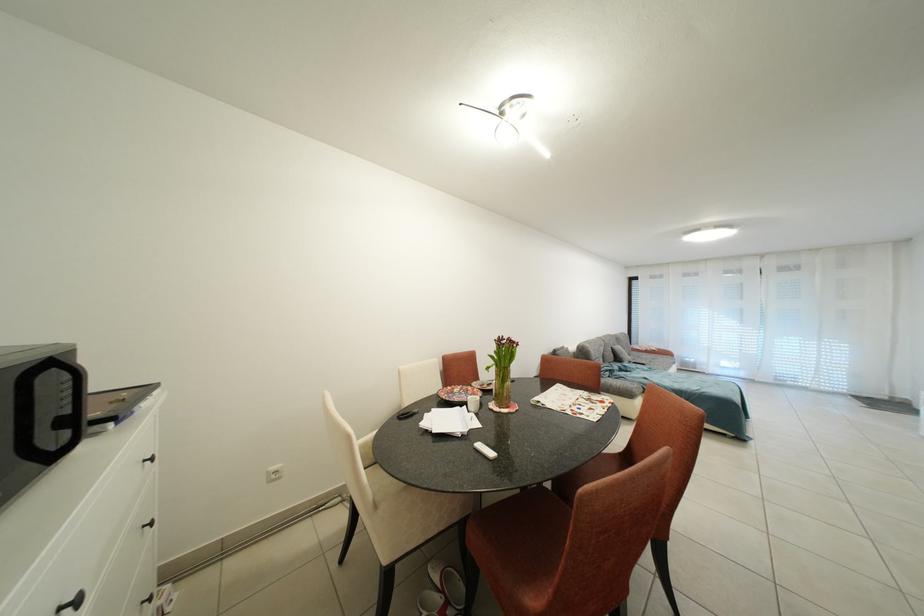
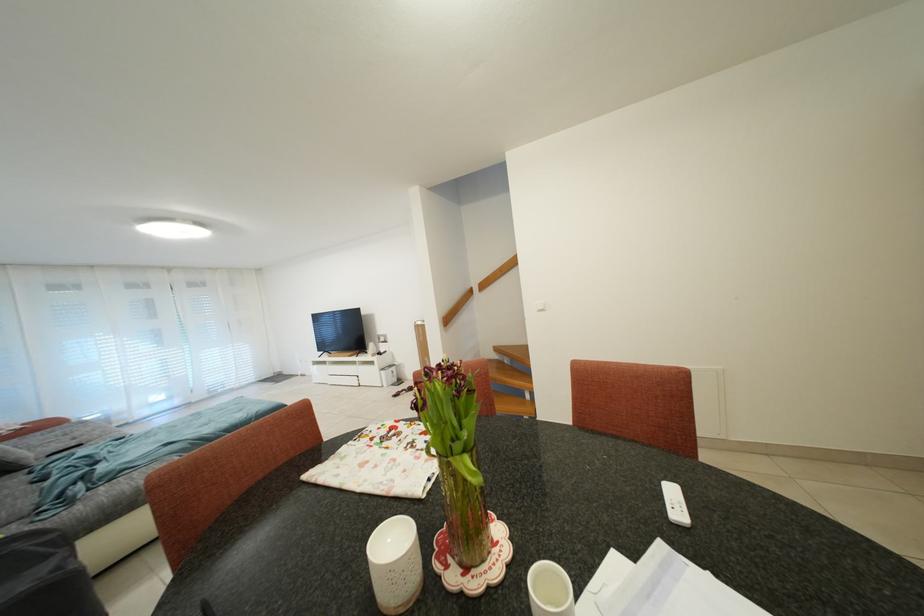
The point at (505, 370) is marked in the first image. Where is the corresponding point in the second image?

(472, 455)